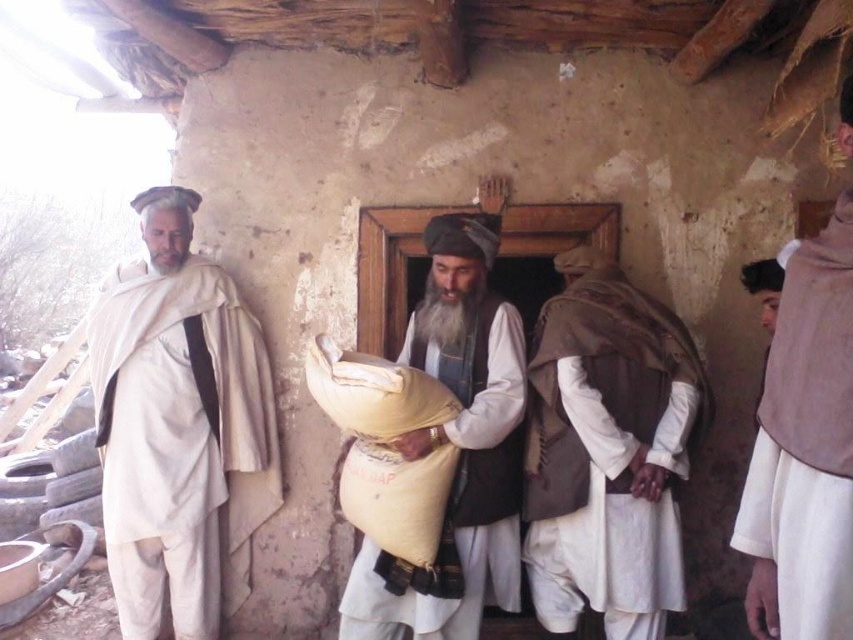
Question: Which point appears closest to the camera in this image?

Choices:
 (A) 480,449
 (B) 595,488
 (C) 785,273
 (D) 250,332

Answer: (C)

Question: Which of the following is the farthest from the observer?

Choices:
 (A) brown textured vest at right
 (B) white cotton robe at right

Answer: (A)

Question: Where is brown textured vest at right located in relation to yellow fabric sack at center in the image?

Choices:
 (A) right
 (B) left

Answer: (A)

Question: Does white matte clothing at left appear under white cotton robe at right?

Choices:
 (A) yes
 (B) no

Answer: (A)

Question: In this image, where is yellow fabric sack at center located relative to white cotton robe at right?

Choices:
 (A) above
 (B) below

Answer: (B)

Question: Considering the real-world distances, which object is closest to the white cotton robe at right?

Choices:
 (A) yellow fabric sack at center
 (B) white matte clothing at left
 (C) brown textured vest at right

Answer: (C)